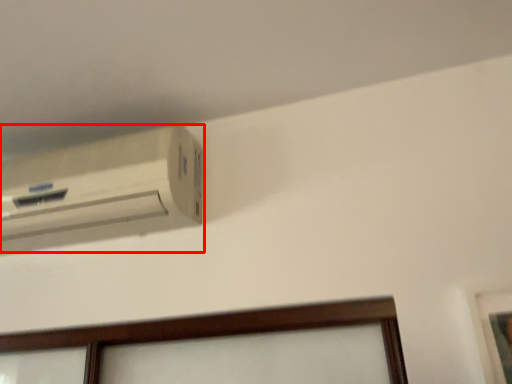
Question: Where is air conditioning (annotated by the red box) located in relation to picture frame in the image?

Choices:
 (A) left
 (B) right

Answer: (A)